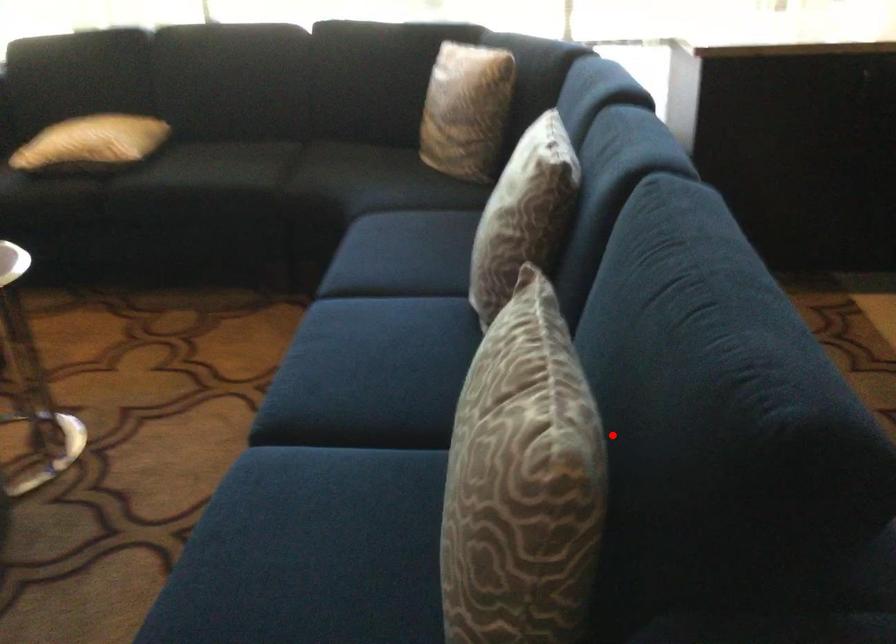
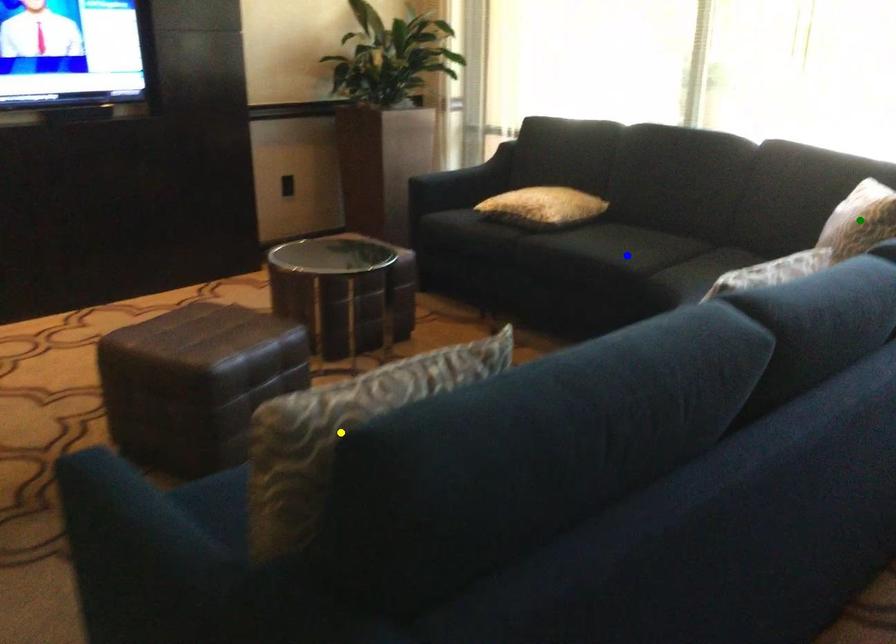
Question: I am providing you with two images of the same scene from different viewpoints. A red point is marked on the first image. You are given multiple points on the second image. Which mark in image 2 goes with the point in image 1?

Choices:
 (A) yellow point
 (B) green point
 (C) blue point

Answer: (A)